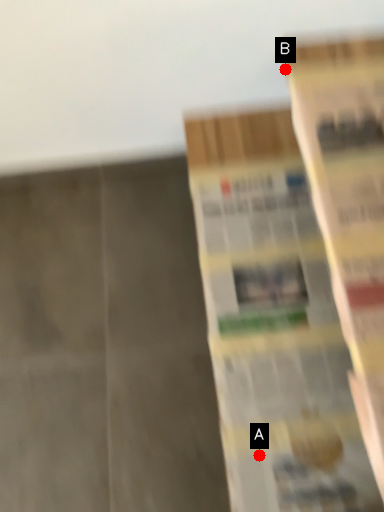
Question: Two points are circled on the image, labeled by A and B beside each circle. Which point appears farthest from the camera in this image?

Choices:
 (A) A is further
 (B) B is further

Answer: (B)